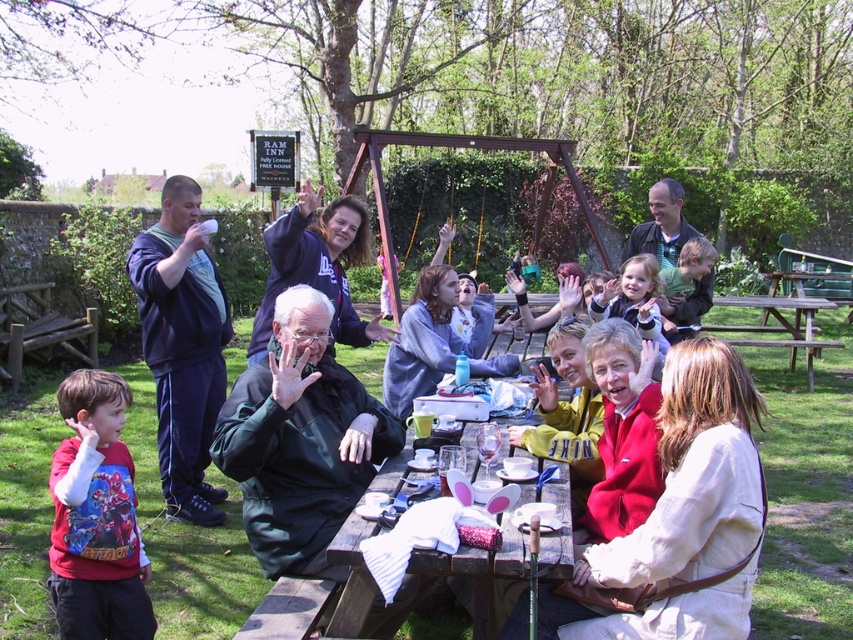
You are organizing a small gathering and need to know if there is enough space for an additional chair. Based on the scene, can the wooden picnic table at center accommodate another chair without overlapping with the matte green jacket at center?

The wooden picnic table at center occupies less space than matte green jacket at center, so there might be enough space to add another chair without overlapping.

You are standing at the edge of the gathering and want to greet the person in the green matte jacket at center. Which direction should you walk relative to the wooden picnic table at center?

The green matte jacket at center is above the wooden picnic table at center, so you should walk towards the upper area relative to the wooden picnic table at center to reach the person in the green matte jacket at center.

You are standing at the center of the image and want to find the green matte jacket at center. Which direction should you look to locate it?

The green matte jacket at center is located at coordinates 0.684 on the x axis and 0.352 on the y axis, so you should look towards the right and slightly down from the center.